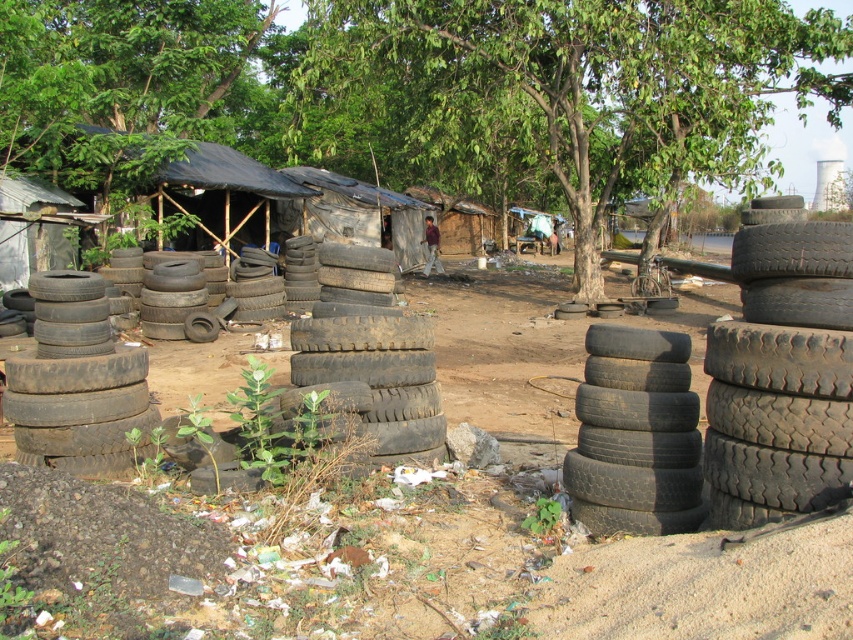
Question: Can you confirm if black rubber tires at right is bigger than worn rubber tires at center?

Choices:
 (A) no
 (B) yes

Answer: (B)

Question: Which of the following is the farthest from the observer?

Choices:
 (A) dark grey rubber tire at left
 (B) green leafy tree at center

Answer: (B)

Question: Estimate the real-world distances between objects in this image. Which object is farther from the green leafy tree at upper center?

Choices:
 (A) dull brown dirt at center
 (B) dark grey rubber tires at right
 (C) dark grey rubber tire at left

Answer: (A)

Question: Can you confirm if dark grey rubber tire at left is positioned to the right of worn rubber tires at center?

Choices:
 (A) no
 (B) yes

Answer: (A)

Question: Is black rubber tires at right above black rubber tires at center?

Choices:
 (A) yes
 (B) no

Answer: (A)

Question: Considering the real-world distances, which object is closest to the dull brown dirt at center?

Choices:
 (A) dark grey rubber tires at right
 (B) black rubber tires at right
 (C) green leafy tree at upper center
 (D) green leafy tree at center

Answer: (A)